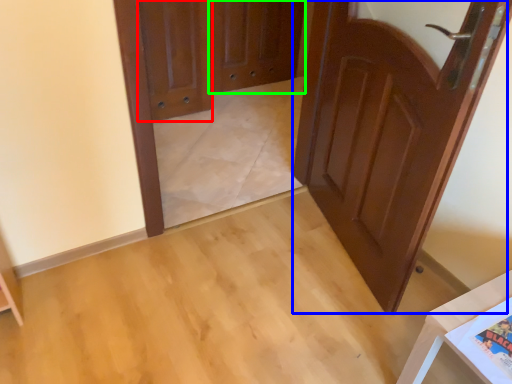
Question: Which is farther away from door (highlighted by a red box)? door (highlighted by a blue box) or screen door (highlighted by a green box)?

Choices:
 (A) door
 (B) screen door

Answer: (A)